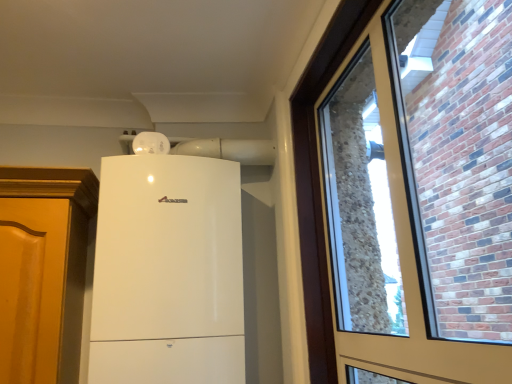
This screenshot has width=512, height=384. Describe the element at coordinates (168, 272) in the screenshot. I see `white glossy refrigerator at upper center` at that location.

At what (x,y) coordinates should I click in order to perform the action: click on white glossy refrigerator at upper center. Please return your answer as a coordinate pair (x, y). The image size is (512, 384). Looking at the image, I should click on (168, 272).

In order to face matte glass window at right, should I rotate leftwards or rightwards?

Rotate your view right by about 16.542°.

What is the approximate width of matte glass window at right?

It is 12.64 centimeters.

What do you see at coordinates (395, 225) in the screenshot? I see `matte glass window at right` at bounding box center [395, 225].

Where is `matte glass window at right`? The image size is (512, 384). matte glass window at right is located at coordinates (395, 225).

I want to click on white glossy refrigerator at upper center, so click(168, 272).

Between white glossy refrigerator at upper center and matte glass window at right, which one appears on the right side from the viewer's perspective?

From the viewer's perspective, matte glass window at right appears more on the right side.

Considering their positions, is white glossy refrigerator at upper center located in front of or behind matte glass window at right?

white glossy refrigerator at upper center is positioned farther from the viewer than matte glass window at right.

Does point (112, 302) come farther from viewer compared to point (312, 67)?

Yes, point (112, 302) is behind point (312, 67).

From the image's perspective, is white glossy refrigerator at upper center over matte glass window at right?

No, from the image's perspective, white glossy refrigerator at upper center is not above matte glass window at right.

From a real-world perspective, who is located lower, white glossy refrigerator at upper center or matte glass window at right?

white glossy refrigerator at upper center, from a real-world perspective.

From the picture: Can you confirm if white glossy refrigerator at upper center is wider than matte glass window at right?

Yes.

Can you confirm if white glossy refrigerator at upper center is shorter than matte glass window at right?

In fact, white glossy refrigerator at upper center may be taller than matte glass window at right.

Between white glossy refrigerator at upper center and matte glass window at right, which one has smaller size?

Smaller between the two is matte glass window at right.

Would you say white glossy refrigerator at upper center is inside or outside matte glass window at right?

white glossy refrigerator at upper center is outside matte glass window at right.

Is white glossy refrigerator at upper center directly adjacent to matte glass window at right?

No, white glossy refrigerator at upper center is not making contact with matte glass window at right.

Is white glossy refrigerator at upper center oriented away from matte glass window at right?

white glossy refrigerator at upper center is not turned away from matte glass window at right.

How many degrees apart are the facing directions of white glossy refrigerator at upper center and matte glass window at right?

90 degrees separate the facing orientations of white glossy refrigerator at upper center and matte glass window at right.

This screenshot has height=384, width=512. I want to click on refrigerator lying behind the matte glass window at right, so click(168, 272).

Visually, is matte glass window at right positioned to the left or to the right of white glossy refrigerator at upper center?

In the image, matte glass window at right appears on the right side of white glossy refrigerator at upper center.

Considering the positions of objects matte glass window at right and white glossy refrigerator at upper center in the image provided, who is behind, matte glass window at right or white glossy refrigerator at upper center?

white glossy refrigerator at upper center is more distant.

Which is less distant, (295, 131) or (140, 296)?

Point (295, 131) is positioned farther from the camera compared to point (140, 296).

From the image's perspective, does matte glass window at right appear lower than white glossy refrigerator at upper center?

Actually, matte glass window at right appears above white glossy refrigerator at upper center in the image.

Based on the photo, from a real-world perspective, is matte glass window at right physically located above or below white glossy refrigerator at upper center?

From a real-world perspective, matte glass window at right is physically above white glossy refrigerator at upper center.

Can you confirm if matte glass window at right is thinner than white glossy refrigerator at upper center?

Correct, the width of matte glass window at right is less than that of white glossy refrigerator at upper center.

Considering the sizes of matte glass window at right and white glossy refrigerator at upper center in the image, is matte glass window at right taller or shorter than white glossy refrigerator at upper center?

Clearly, matte glass window at right is shorter compared to white glossy refrigerator at upper center.

Considering the relative sizes of matte glass window at right and white glossy refrigerator at upper center in the image provided, is matte glass window at right bigger than white glossy refrigerator at upper center?

Incorrect, matte glass window at right is not larger than white glossy refrigerator at upper center.

Could white glossy refrigerator at upper center be considered to be inside matte glass window at right?

Actually, white glossy refrigerator at upper center is outside matte glass window at right.

Is matte glass window at right next to white glossy refrigerator at upper center?

No, matte glass window at right is not with white glossy refrigerator at upper center.

Is matte glass window at right oriented away from white glossy refrigerator at upper center?

No.

How far apart are matte glass window at right and white glossy refrigerator at upper center?

The distance of matte glass window at right from white glossy refrigerator at upper center is 16.12 inches.

Identify the location of refrigerator that is under the matte glass window at right (from a real-world perspective). The image size is (512, 384). (168, 272).

Identify the location of window on the right side of white glossy refrigerator at upper center. (395, 225).

Locate an element on the screen. The width and height of the screenshot is (512, 384). refrigerator behind the matte glass window at right is located at coordinates [x=168, y=272].